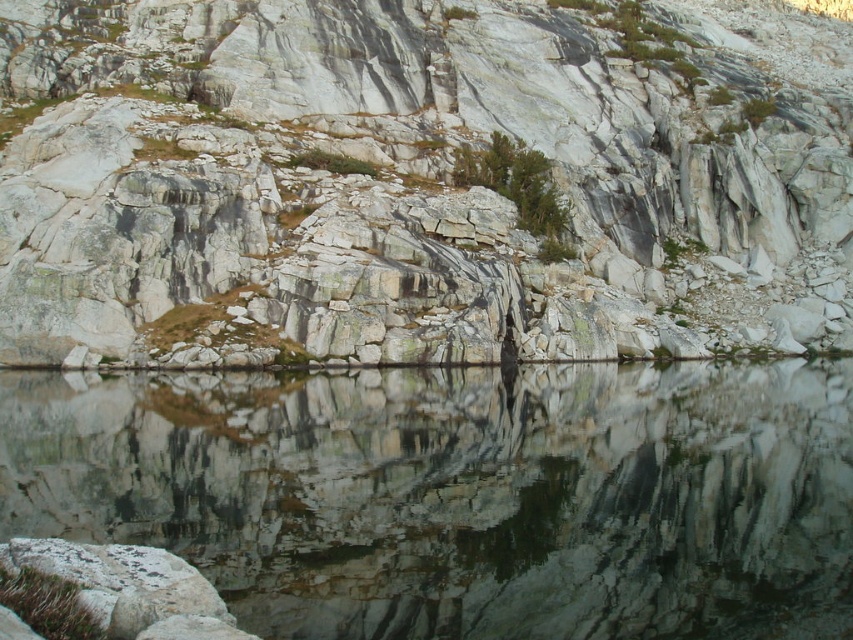
You are standing at the edge of the cliff and want to throw a pebble into the water. Considering the granite rock at center and the reflective smooth water at center, which one is closer to you?

The reflective smooth water at center is closer to you since it is at the base of the cliff, while the granite rock at center is part of the cliff itself and farther away.